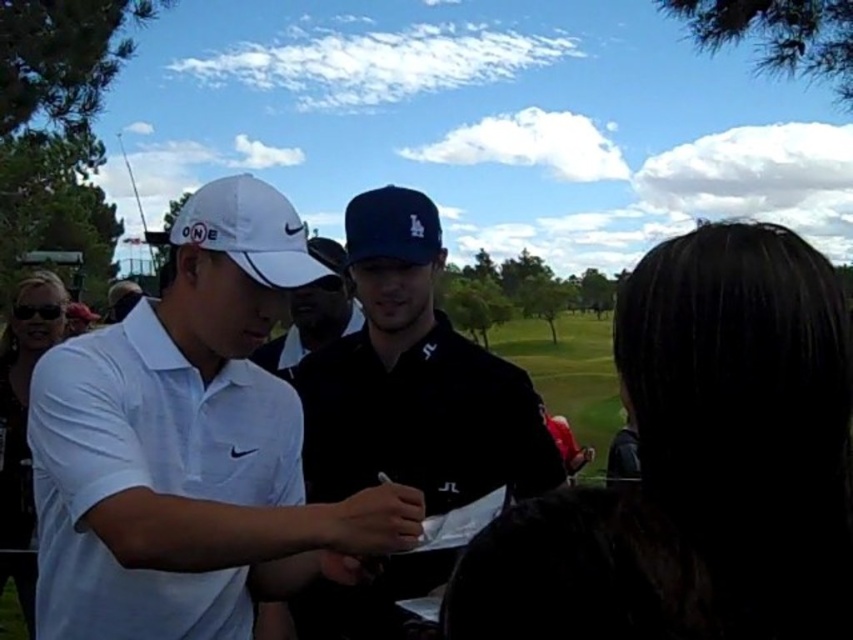
Between matte black sunglasses at left and white matte cap at center, which one is positioned lower?

Positioned lower is matte black sunglasses at left.

Is point (3, 568) closer to viewer compared to point (328, 246)?

No.

Identify the location of matte black sunglasses at left. (22, 426).

Can you confirm if matte black cap at center is positioned to the right of blue fabric baseball cap at center?

Correct, you'll find matte black cap at center to the right of blue fabric baseball cap at center.

Does matte black cap at center appear over blue fabric baseball cap at center?

No, matte black cap at center is not above blue fabric baseball cap at center.

Which is behind, point (323, 460) or point (358, 212)?

Point (323, 460)

Image resolution: width=853 pixels, height=640 pixels. Find the location of `matte black cap at center`. matte black cap at center is located at coordinates (415, 378).

Can you confirm if white matte baseball cap at left is positioned below white matte cap at center?

Incorrect, white matte baseball cap at left is not positioned below white matte cap at center.

Is point (283, 248) behind point (323, 240)?

No, it is in front of (323, 240).

At what (x,y) coordinates should I click in order to perform the action: click on white matte baseball cap at left. Please return your answer as a coordinate pair (x, y). Looking at the image, I should click on (248, 232).

You are a GUI agent. You are given a task and a screenshot of the screen. Output one action in this format:
    pyautogui.click(x=<x>, y=<y>)
    Task: Click on the white matte baseball cap at left
    
    Given the screenshot: What is the action you would take?
    pyautogui.click(x=248, y=232)